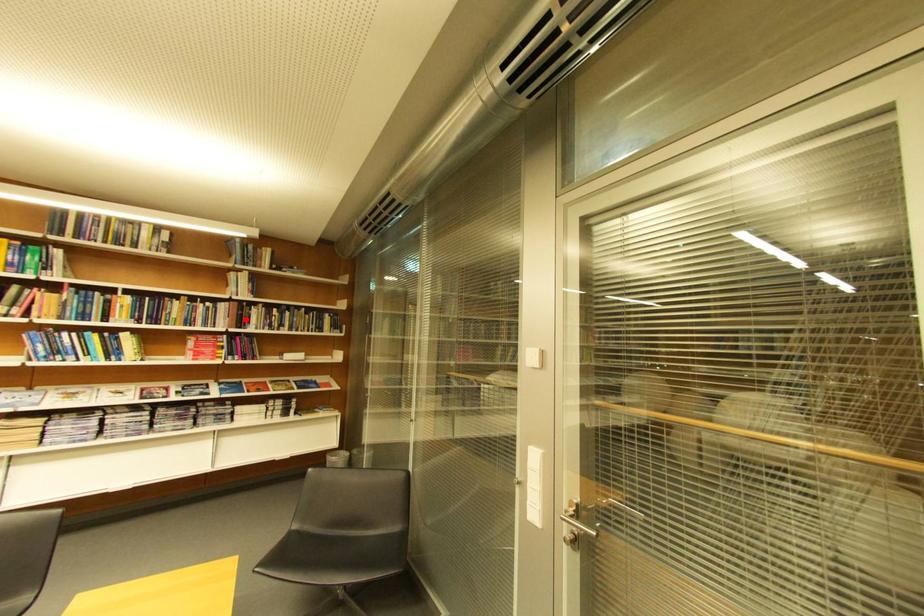
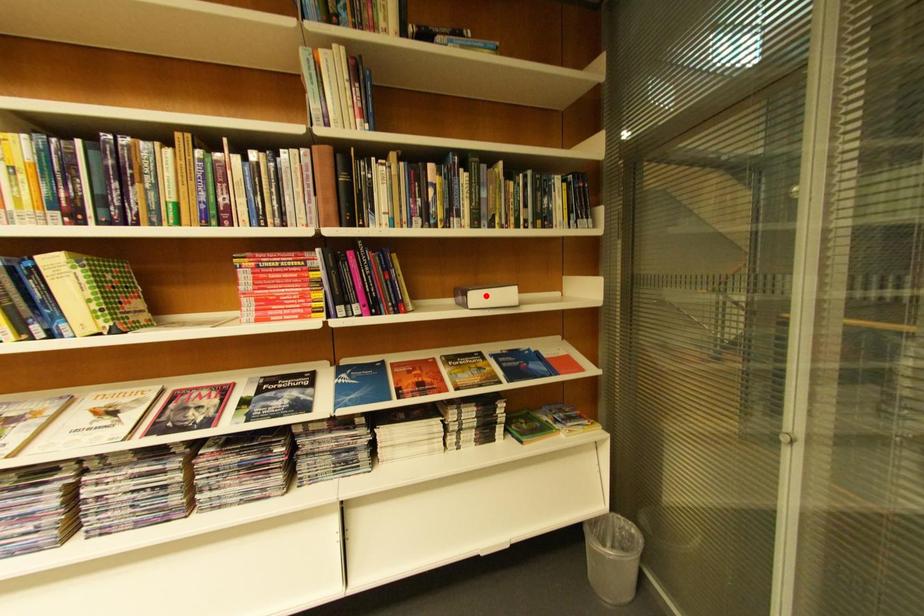
I am providing you with two images of the same scene from different viewpoints. A red point is marked on the first image and another point is marked on the second image. Is the marked point in image1 the same physical position as the marked point in image2?

No